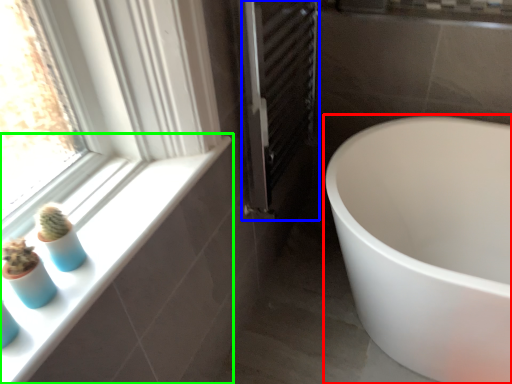
Question: Which object is the closest to the bathtub (highlighted by a red box)? Choose among these: screen door (highlighted by a blue box) or window sill (highlighted by a green box).

Choices:
 (A) screen door
 (B) window sill

Answer: (A)